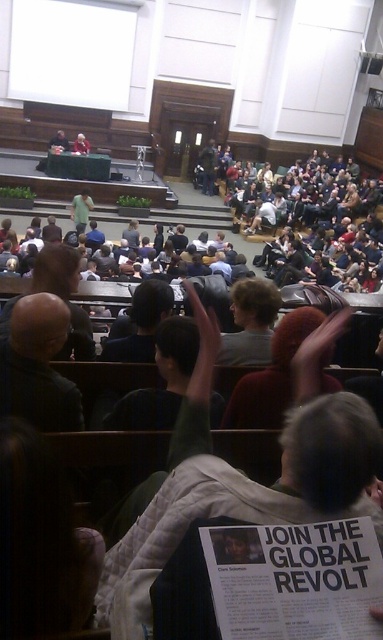
Question: Does bald head at left have a greater width compared to light gray sweater at center?

Choices:
 (A) yes
 (B) no

Answer: (B)

Question: Which of the following is the farthest from the observer?

Choices:
 (A) (16, 362)
 (B) (72, 218)

Answer: (B)

Question: Is bald head at left in front of light gray sweater at center?

Choices:
 (A) yes
 (B) no

Answer: (A)

Question: Which point is farther to the camera?

Choices:
 (A) (73, 211)
 (B) (45, 372)

Answer: (A)

Question: Can you confirm if bald head at left is wider than light gray sweater at center?

Choices:
 (A) no
 (B) yes

Answer: (A)